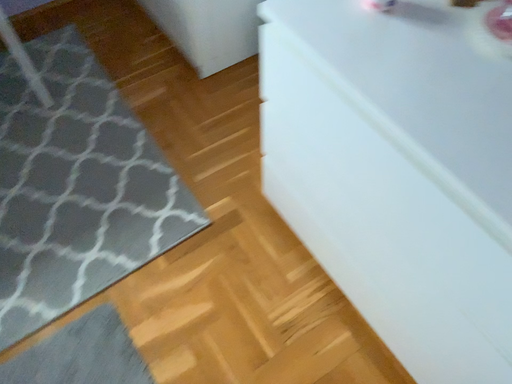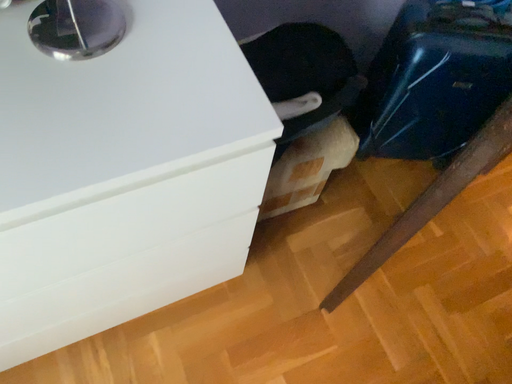
Question: How did the camera likely rotate when shooting the video?

Choices:
 (A) rotated downward
 (B) rotated upward

Answer: (B)